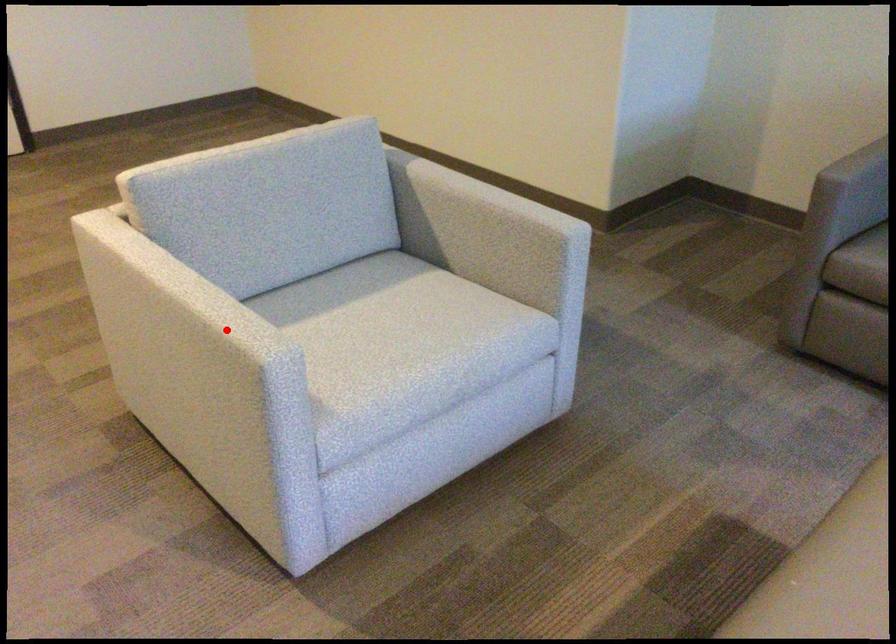
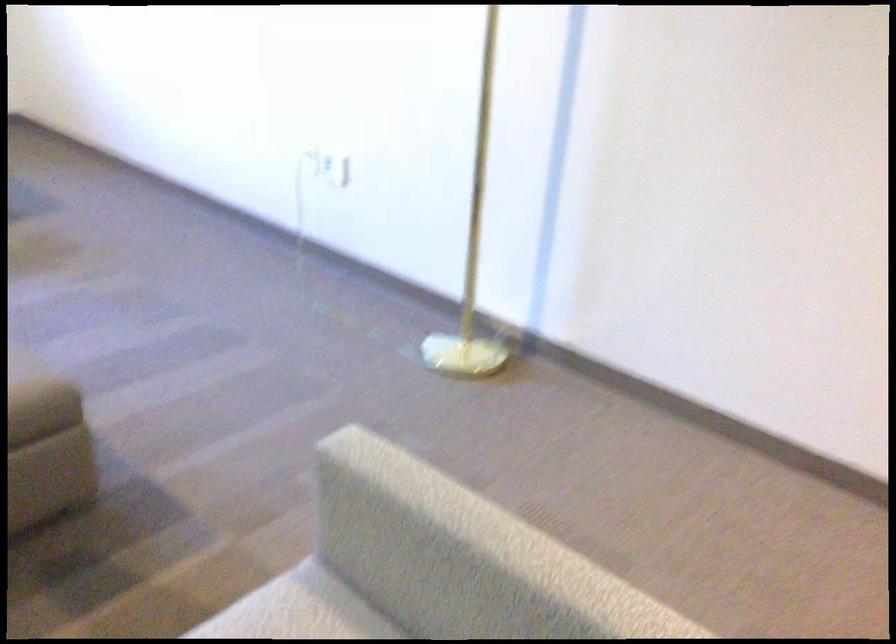
Question: I am providing you with two images of the same scene from different viewpoints. A red point is shown in image1. For the corresponding object point in image2, is it positioned nearer or farther from the camera?

Choices:
 (A) Nearer
 (B) Farther

Answer: (A)